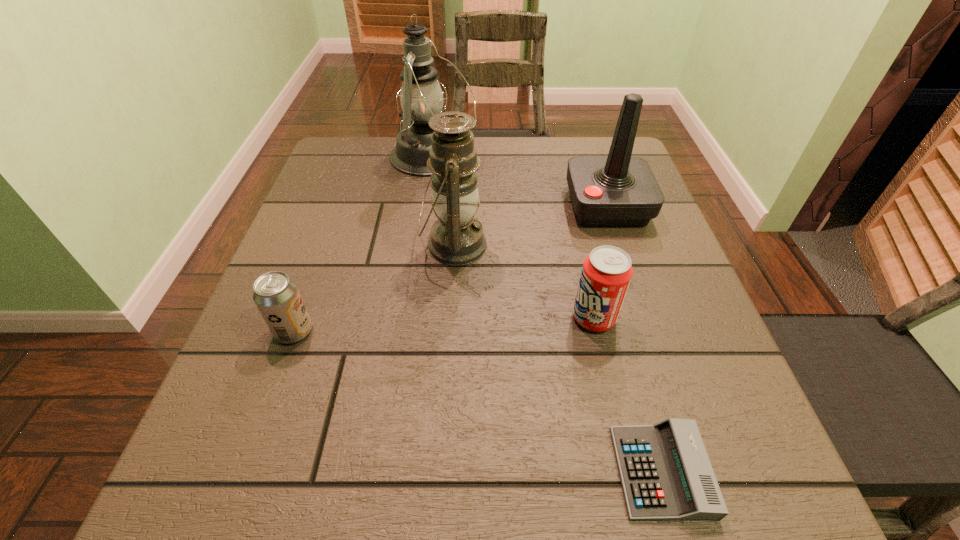
Find the location of a particular element. object present at the left edge is located at coordinates [x=276, y=295].

The image size is (960, 540). Find the location of `joystick present at the right edge`. joystick present at the right edge is located at coordinates (619, 190).

In order to click on soda can that is at the right edge in this screenshot , I will do `click(607, 271)`.

Where is `calculator that is positioned at the right edge`? This screenshot has width=960, height=540. calculator that is positioned at the right edge is located at coordinates (666, 474).

Where is `object located in the far right corner section of the desktop`? The height and width of the screenshot is (540, 960). object located in the far right corner section of the desktop is located at coordinates (619, 190).

Where is `object that is at the near right corner`? Image resolution: width=960 pixels, height=540 pixels. object that is at the near right corner is located at coordinates (666, 474).

The width and height of the screenshot is (960, 540). I want to click on vacant space at the far edge of the desktop, so click(524, 145).

This screenshot has width=960, height=540. Identify the location of vacant area at the near edge of the desktop. (521, 459).

The width and height of the screenshot is (960, 540). In order to click on free spot at the left edge of the desktop in this screenshot , I will do pos(289,247).

Where is `free space at the right edge of the desktop`? free space at the right edge of the desktop is located at coordinates (640, 304).